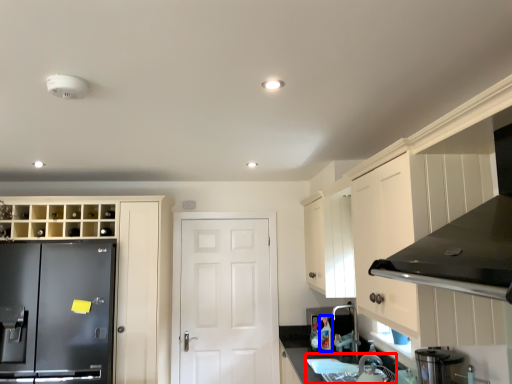
Question: Which object appears closest to the camera in this image, sink (highlighted by a red box) or bottle (highlighted by a blue box)?

Choices:
 (A) sink
 (B) bottle

Answer: (A)